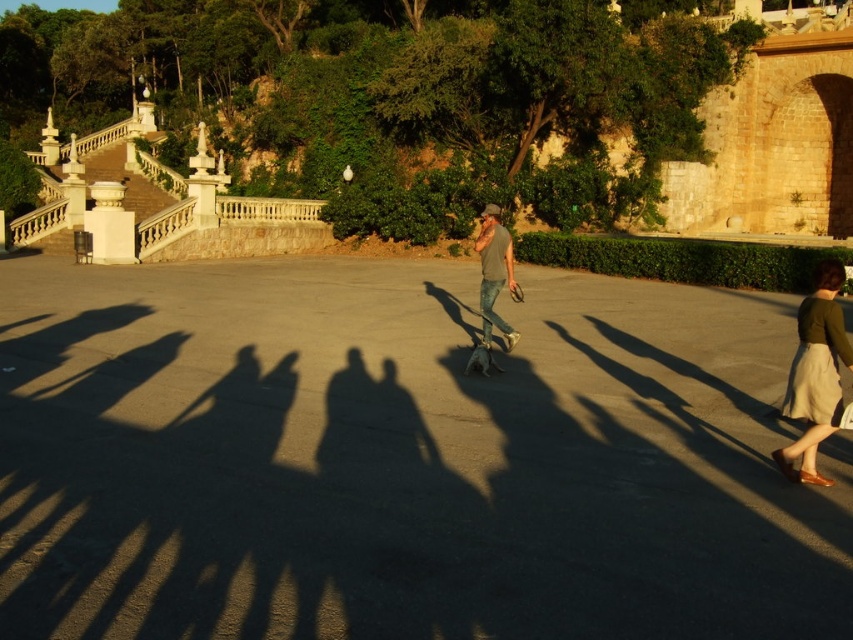
Question: Is matte gray shirt at center to the right of wooden skateboard at center from the viewer's perspective?

Choices:
 (A) yes
 (B) no

Answer: (A)

Question: Based on their relative distances, which object is farther from the matte gray shirt at center?

Choices:
 (A) wooden skateboard at center
 (B) green fabric skirt at right

Answer: (B)

Question: Can you confirm if green fabric skirt at right is positioned to the right of wooden skateboard at center?

Choices:
 (A) yes
 (B) no

Answer: (A)

Question: Which point appears closest to the camera in this image?

Choices:
 (A) (503, 284)
 (B) (486, 362)

Answer: (B)

Question: Is green fabric skirt at right positioned at the back of matte gray shirt at center?

Choices:
 (A) no
 (B) yes

Answer: (A)

Question: Which of these objects is positioned farthest from the green fabric skirt at right?

Choices:
 (A) wooden skateboard at center
 (B) matte gray shirt at center

Answer: (B)